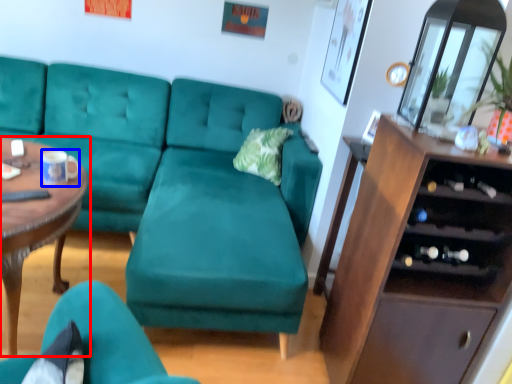
Question: Which point is further to the camera, coffee table (highlighted by a red box) or coffee cup (highlighted by a blue box)?

Choices:
 (A) coffee table
 (B) coffee cup

Answer: (B)